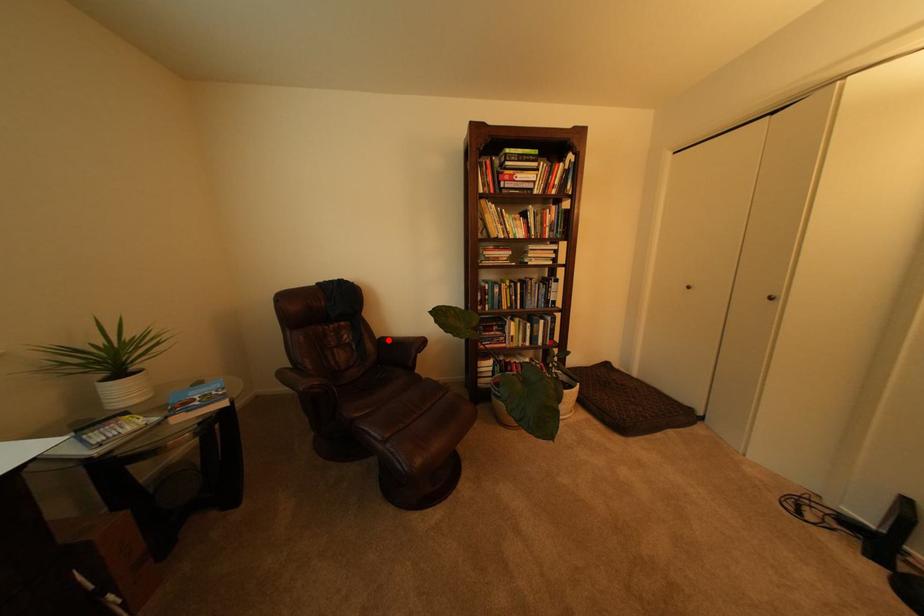
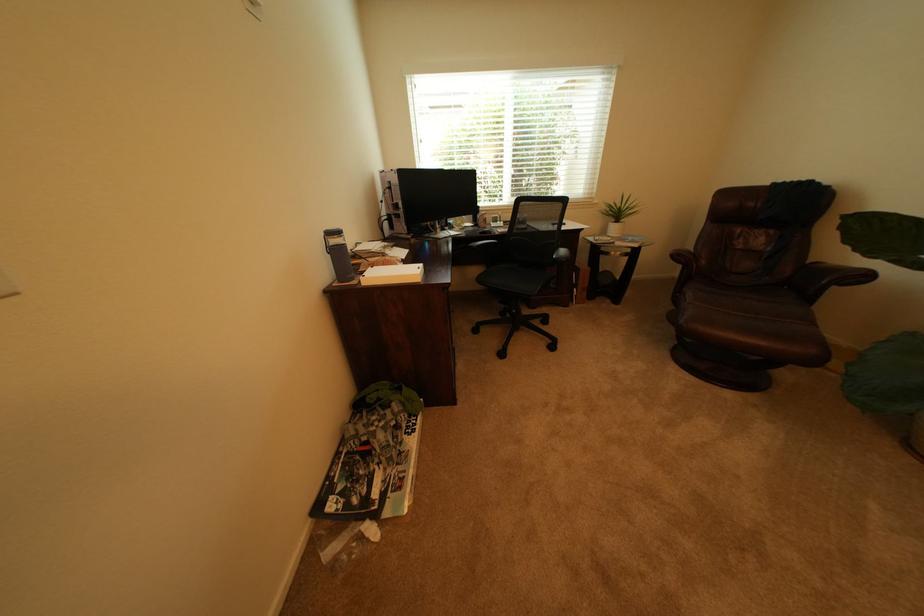
Find the pixel in the second image that matches the highlighted location in the first image.

(821, 262)